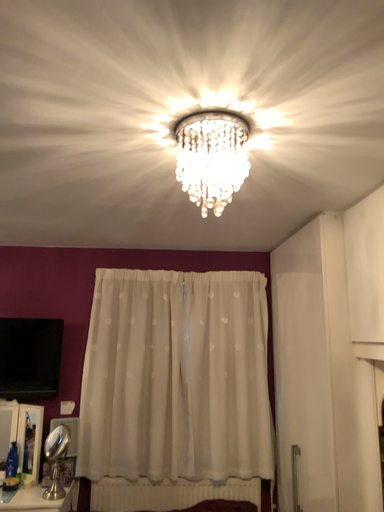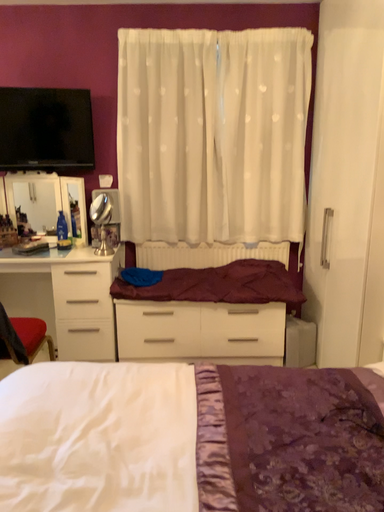
Question: How did the camera likely rotate when shooting the video?

Choices:
 (A) rotated upward
 (B) rotated downward

Answer: (B)